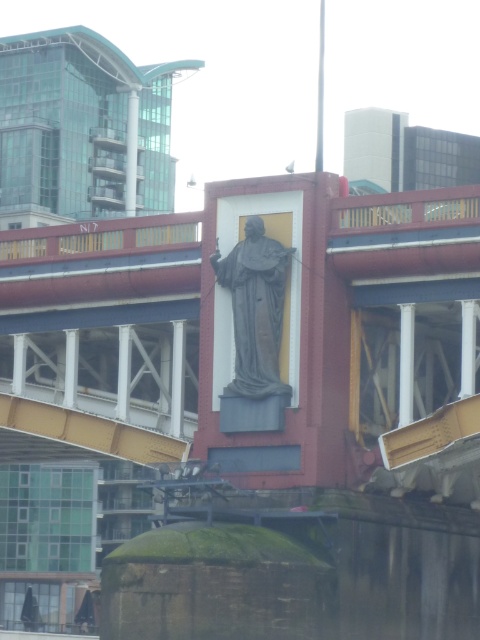
Between concrete bridge at center and gray stone statue at center, which one appears on the right side from the viewer's perspective?

gray stone statue at center is more to the right.

The height and width of the screenshot is (640, 480). In order to click on concrete bridge at center in this screenshot , I will do `click(247, 326)`.

You are a GUI agent. You are given a task and a screenshot of the screen. Output one action in this format:
    pyautogui.click(x=<x>, y=<y>)
    Task: Click on the concrete bridge at center
    
    Given the screenshot: What is the action you would take?
    pyautogui.click(x=247, y=326)